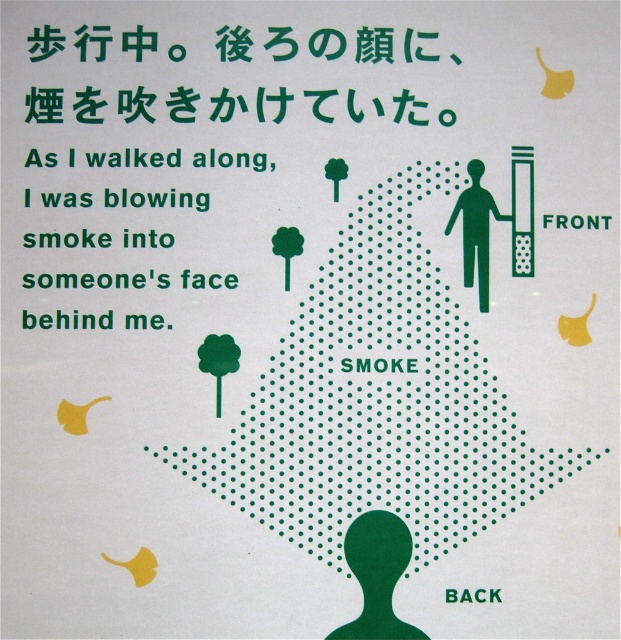
Consider the image. What is the exact coordinate of the green dotted text at upper center?

The green dotted text at upper center is located at coordinate point (268,115).

You are looking at the graphic illustration and notice two points marked at coordinates point (37, 109) and point (481, 308). Which point is closer to you?

Point (37, 109) is further to the camera than point (481, 308), so the closer point to you is point (481, 308).